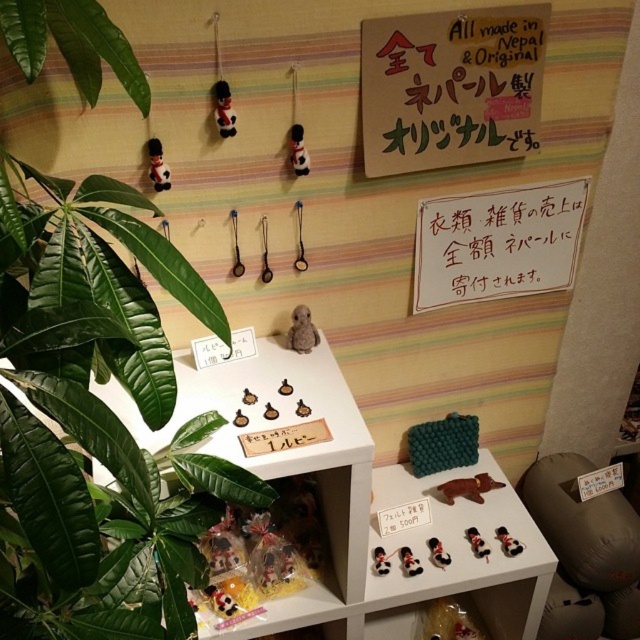
Question: Which point is closer to the camera?

Choices:
 (A) click(x=316, y=342)
 (B) click(x=294, y=260)
 (C) click(x=154, y=168)
 (D) click(x=289, y=138)

Answer: (C)

Question: Can you confirm if green leafy plant at left is positioned above brown cardboard sign at upper center?

Choices:
 (A) no
 (B) yes

Answer: (A)

Question: Does black plush toy at lower center have a lesser width compared to wooden bear at center?

Choices:
 (A) yes
 (B) no

Answer: (B)

Question: Which object is farther from the camera taking this photo?

Choices:
 (A) green leafy plant at left
 (B) matte black toy at center

Answer: (B)

Question: Considering the real-world distances, which object is farthest from the velvet-like plush toy at upper left?

Choices:
 (A) metallic hook at center
 (B) brown matte bear at lower right
 (C) brown cardboard sign at upper center
 (D) brown paper sign at upper center

Answer: (B)

Question: Can you confirm if brown matte bear at lower right is positioned to the left of wooden bear at center?

Choices:
 (A) no
 (B) yes

Answer: (A)